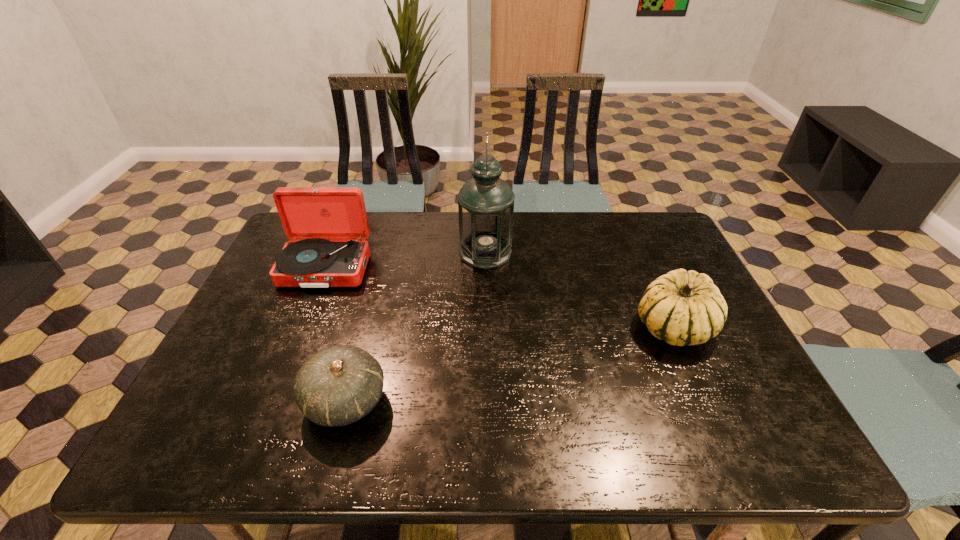
Locate an element on the screen. This screenshot has width=960, height=540. vacant point located between the second tallest object and the nearest object is located at coordinates (335, 335).

The width and height of the screenshot is (960, 540). In order to click on the second closest object to the right gourd in this screenshot , I will do `click(338, 385)`.

The image size is (960, 540). Identify the location of object that can be found as the third closest to the left gourd. (682, 307).

Where is `vacant region that satisfies the following two spatial constraints: 1. on the front side of the tallest object; 2. on the right side of the rightmost object`? vacant region that satisfies the following two spatial constraints: 1. on the front side of the tallest object; 2. on the right side of the rightmost object is located at coordinates (487, 327).

This screenshot has width=960, height=540. Find the location of `vacant space that satisfies the following two spatial constraints: 1. on the front-facing side of the phonograph_record; 2. on the right side of the left gourd`. vacant space that satisfies the following two spatial constraints: 1. on the front-facing side of the phonograph_record; 2. on the right side of the left gourd is located at coordinates (271, 401).

Find the location of `free space in the image that satisfies the following two spatial constraints: 1. on the front side of the right gourd; 2. on the right side of the oil lamp`. free space in the image that satisfies the following two spatial constraints: 1. on the front side of the right gourd; 2. on the right side of the oil lamp is located at coordinates [487, 327].